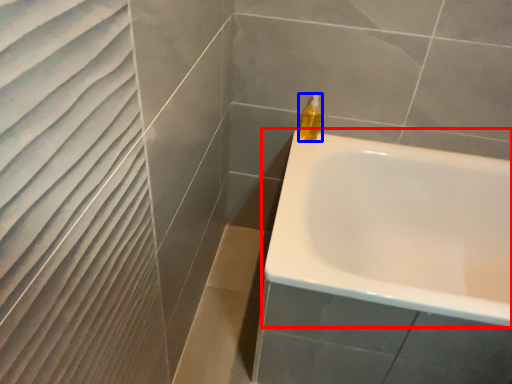
Question: Which object appears farthest to the camera in this image, bathtub (highlighted by a red box) or soap dispenser (highlighted by a blue box)?

Choices:
 (A) bathtub
 (B) soap dispenser

Answer: (B)